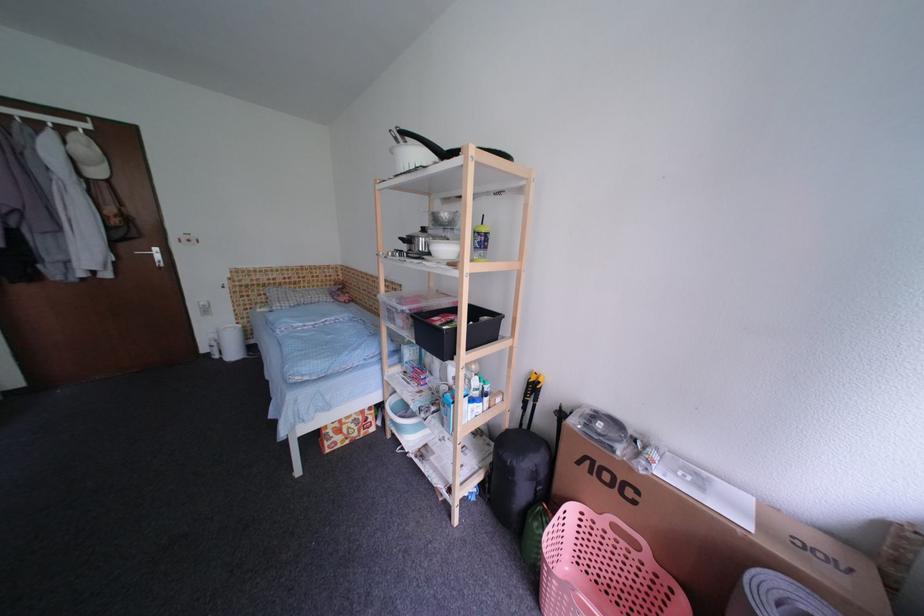
Describe the element at coordinates (151, 253) in the screenshot. The image size is (924, 616). I see `the silver door handle` at that location.